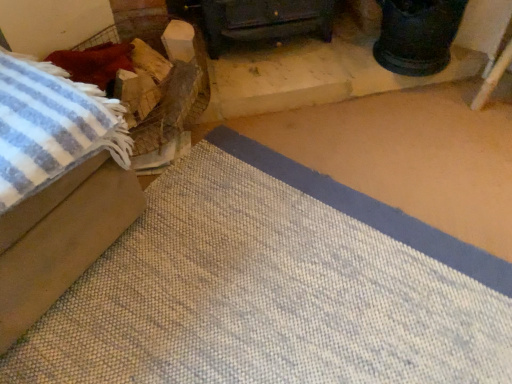
The width and height of the screenshot is (512, 384). Identify the location of beige fabric ottoman at left, marked as the 2th furniture in a back-to-front arrangement. (61, 238).

Describe the element at coordinates (61, 238) in the screenshot. I see `beige fabric ottoman at left, marked as the 2th furniture in a back-to-front arrangement` at that location.

Describe the element at coordinates (265, 20) in the screenshot. The image size is (512, 384). I see `dark wood stove at center, the 2th furniture when ordered from front to back` at that location.

Measure the distance between dark wood stove at center, the 2th furniture when ordered from front to back, and camera.

dark wood stove at center, the 2th furniture when ordered from front to back, and camera are 1.53 meters apart from each other.

In order to click on dark wood stove at center, which appears as the second furniture when viewed from the left in this screenshot , I will do click(x=265, y=20).

Where is `beige fabric ottoman at left, the first furniture positioned from the front`? beige fabric ottoman at left, the first furniture positioned from the front is located at coordinates (61, 238).

Can you confirm if beige fabric ottoman at left, the first furniture positioned from the front, is positioned to the right of dark wood stove at center, which appears as the 1th furniture when viewed from the right?

In fact, beige fabric ottoman at left, the first furniture positioned from the front, is to the left of dark wood stove at center, which appears as the 1th furniture when viewed from the right.

Is beige fabric ottoman at left, which is the second furniture in right-to-left order, further to camera compared to dark wood stove at center, which appears as the 1th furniture when viewed from the right?

No, beige fabric ottoman at left, which is the second furniture in right-to-left order, is closer to the viewer.

Which point is more forward, (86,184) or (203,14)?

The point (86,184) is closer to the camera.

From the image's perspective, relative to dark wood stove at center, which appears as the second furniture when viewed from the left, is beige fabric ottoman at left, which is the second furniture in right-to-left order, above or below?

beige fabric ottoman at left, which is the second furniture in right-to-left order, is situated lower than dark wood stove at center, which appears as the second furniture when viewed from the left, in the image.

From a real-world perspective, is beige fabric ottoman at left, the first furniture positioned from the front, positioned under dark wood stove at center, the 2th furniture when ordered from front to back, based on gravity?

No, from a real-world perspective, beige fabric ottoman at left, the first furniture positioned from the front, is not below dark wood stove at center, the 2th furniture when ordered from front to back.

Considering the relative sizes of beige fabric ottoman at left, the first furniture positioned from the front, and dark wood stove at center, the 1th furniture viewed from the back, in the image provided, is beige fabric ottoman at left, the first furniture positioned from the front, thinner than dark wood stove at center, the 1th furniture viewed from the back,?

No, beige fabric ottoman at left, the first furniture positioned from the front, is not thinner than dark wood stove at center, the 1th furniture viewed from the back.

From their relative heights in the image, would you say beige fabric ottoman at left, which is the 1th furniture from left to right, is taller or shorter than dark wood stove at center, which appears as the second furniture when viewed from the left?

Considering their sizes, beige fabric ottoman at left, which is the 1th furniture from left to right, has more height than dark wood stove at center, which appears as the second furniture when viewed from the left.

Who is bigger, beige fabric ottoman at left, which is the second furniture in right-to-left order, or dark wood stove at center, the 1th furniture viewed from the back?

beige fabric ottoman at left, which is the second furniture in right-to-left order.

Is beige fabric ottoman at left, which is the 1th furniture from left to right, located outside dark wood stove at center, which appears as the second furniture when viewed from the left?

Yes.

Is beige fabric ottoman at left, marked as the 2th furniture in a back-to-front arrangement, not close to dark wood stove at center, which appears as the second furniture when viewed from the left?

That's not correct — beige fabric ottoman at left, marked as the 2th furniture in a back-to-front arrangement, is a little close to dark wood stove at center, which appears as the second furniture when viewed from the left.

In the scene shown: Is dark wood stove at center, which appears as the second furniture when viewed from the left, at the back of beige fabric ottoman at left, marked as the 2th furniture in a back-to-front arrangement?

beige fabric ottoman at left, marked as the 2th furniture in a back-to-front arrangement, does not have its back to dark wood stove at center, which appears as the second furniture when viewed from the left.

How much distance is there between beige fabric ottoman at left, which is the second furniture in right-to-left order, and dark wood stove at center, the 1th furniture viewed from the back?

They are 93.29 centimeters apart.

This screenshot has width=512, height=384. I want to click on furniture in front of the dark wood stove at center, the 2th furniture when ordered from front to back, so click(61, 238).

Is dark wood stove at center, which appears as the 1th furniture when viewed from the right, to the right of beige fabric ottoman at left, which is the 1th furniture from left to right, from the viewer's perspective?

Yes, dark wood stove at center, which appears as the 1th furniture when viewed from the right, is to the right of beige fabric ottoman at left, which is the 1th furniture from left to right.

Is the position of dark wood stove at center, the 1th furniture viewed from the back, less distant than that of beige fabric ottoman at left, the first furniture positioned from the front?

No, dark wood stove at center, the 1th furniture viewed from the back, is behind beige fabric ottoman at left, the first furniture positioned from the front.

Which point is more forward, (x=230, y=16) or (x=87, y=212)?

The point (x=87, y=212) is closer.

Looking at this image, from the image's perspective, is dark wood stove at center, which appears as the 1th furniture when viewed from the right, above or below beige fabric ottoman at left, marked as the 2th furniture in a back-to-front arrangement?

dark wood stove at center, which appears as the 1th furniture when viewed from the right, is situated higher than beige fabric ottoman at left, marked as the 2th furniture in a back-to-front arrangement, in the image.

From a real-world perspective, is dark wood stove at center, the 2th furniture when ordered from front to back, physically above beige fabric ottoman at left, the first furniture positioned from the front?

No.

Considering the sizes of objects dark wood stove at center, which appears as the 1th furniture when viewed from the right, and beige fabric ottoman at left, the first furniture positioned from the front, in the image provided, who is wider, dark wood stove at center, which appears as the 1th furniture when viewed from the right, or beige fabric ottoman at left, the first furniture positioned from the front,?

Wider between the two is beige fabric ottoman at left, the first furniture positioned from the front.

Looking at this image, which of these two, dark wood stove at center, which appears as the 1th furniture when viewed from the right, or beige fabric ottoman at left, which is the 1th furniture from left to right, stands taller?

beige fabric ottoman at left, which is the 1th furniture from left to right.

In terms of size, does dark wood stove at center, which appears as the second furniture when viewed from the left, appear bigger or smaller than beige fabric ottoman at left, the first furniture positioned from the front?

Clearly, dark wood stove at center, which appears as the second furniture when viewed from the left, is smaller in size than beige fabric ottoman at left, the first furniture positioned from the front.

From the picture: Is dark wood stove at center, the 1th furniture viewed from the back, located outside beige fabric ottoman at left, which is the second furniture in right-to-left order?

dark wood stove at center, the 1th furniture viewed from the back, is positioned outside beige fabric ottoman at left, which is the second furniture in right-to-left order.

Is beige fabric ottoman at left, the first furniture positioned from the front, at the back of dark wood stove at center, the 2th furniture when ordered from front to back?

No, dark wood stove at center, the 2th furniture when ordered from front to back, is not facing the opposite direction of beige fabric ottoman at left, the first furniture positioned from the front.

How different are the orientations of dark wood stove at center, which appears as the 1th furniture when viewed from the right, and beige fabric ottoman at left, which is the second furniture in right-to-left order, in degrees?

The angular difference between dark wood stove at center, which appears as the 1th furniture when viewed from the right, and beige fabric ottoman at left, which is the second furniture in right-to-left order, is 43.4 degrees.

Identify the location of furniture directly beneath the beige fabric ottoman at left, which is the second furniture in right-to-left order (from a real-world perspective). (265, 20).

The width and height of the screenshot is (512, 384). In order to click on furniture on the right of the beige fabric ottoman at left, the first furniture positioned from the front in this screenshot , I will do pos(265,20).

Identify the location of furniture that is in front of the dark wood stove at center, the 2th furniture when ordered from front to back. (61, 238).